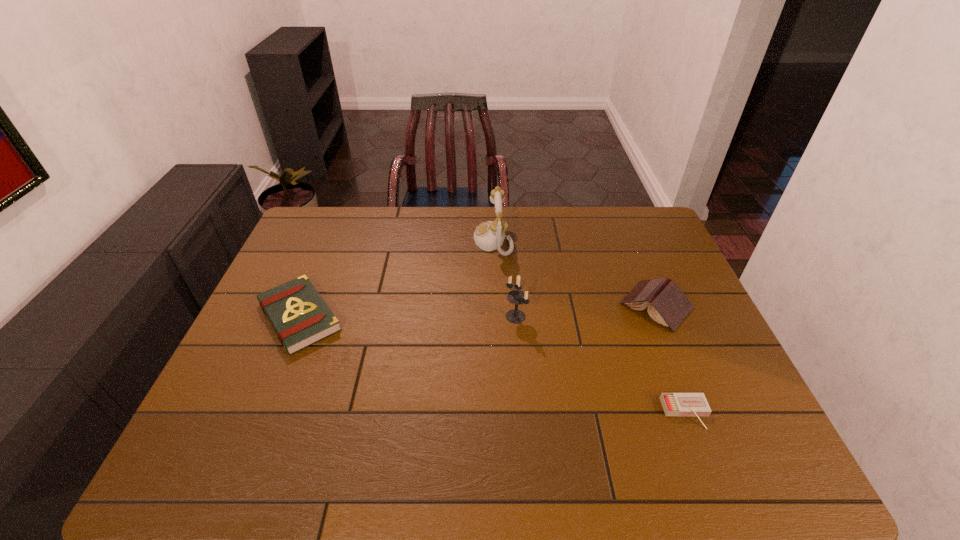
Locate an element on the screen. This screenshot has height=540, width=960. vacant space located 0.150m on the dial of the telephone is located at coordinates (429, 241).

This screenshot has height=540, width=960. What are the coordinates of `free space located 0.200m on the front of the candle holder` in the screenshot? It's located at (521, 390).

Locate an element on the screen. free space located 0.340m on the front of the third tallest object is located at coordinates (717, 454).

This screenshot has width=960, height=540. I want to click on blank area located on the back of the second shortest object, so click(x=327, y=249).

You are a GUI agent. You are given a task and a screenshot of the screen. Output one action in this format:
    pyautogui.click(x=<x>, y=<y>)
    Task: Click on the vacant space located 0.070m on the striking surface of the matchbox
    The height and width of the screenshot is (540, 960).
    Given the screenshot: What is the action you would take?
    pyautogui.click(x=704, y=460)

The width and height of the screenshot is (960, 540). I want to click on object that is at the far edge, so click(x=490, y=235).

What are the coordinates of `object that is at the left edge` in the screenshot? It's located at (300, 317).

Image resolution: width=960 pixels, height=540 pixels. What are the coordinates of `book that is at the right edge` in the screenshot? It's located at (668, 305).

Locate an element on the screen. Image resolution: width=960 pixels, height=540 pixels. matchbox that is positioned at the right edge is located at coordinates (674, 404).

Where is `free space at the far edge`? free space at the far edge is located at coordinates (410, 227).